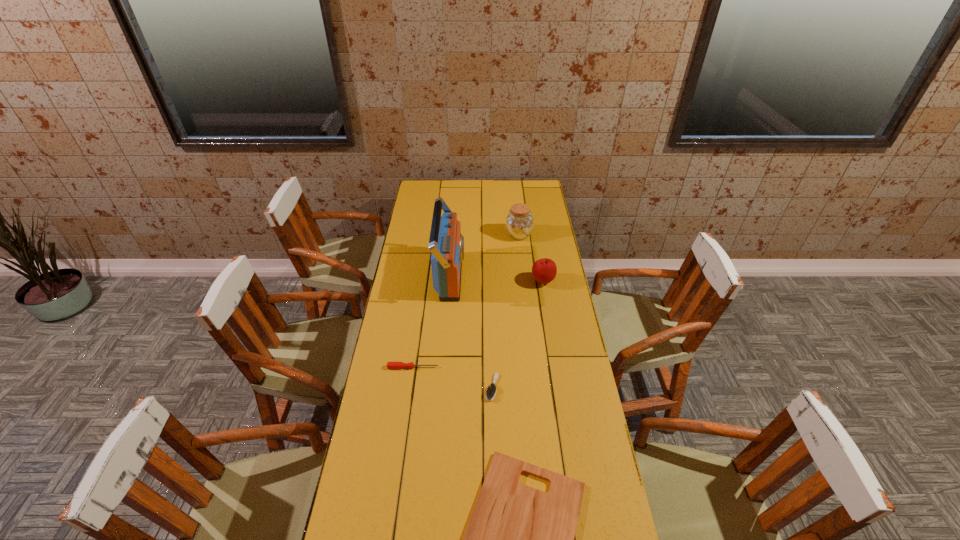
Where is `the tallest object`? The height and width of the screenshot is (540, 960). the tallest object is located at coordinates (446, 243).

Locate an element on the screen. This screenshot has height=540, width=960. the farthest object is located at coordinates (519, 223).

The height and width of the screenshot is (540, 960). Find the location of `jar`. jar is located at coordinates (519, 223).

Find the location of `apple`. apple is located at coordinates (544, 270).

Locate an element on the screen. This screenshot has width=960, height=540. screwdriver is located at coordinates (390, 365).

This screenshot has width=960, height=540. I want to click on the second nearest object, so click(491, 391).

You are a GUI agent. You are given a task and a screenshot of the screen. Output one action in this format:
    pyautogui.click(x=<x>, y=<y>)
    Task: Click on the free location located on the front-facing side of the tallest object
    The height and width of the screenshot is (540, 960).
    Given the screenshot: What is the action you would take?
    pyautogui.click(x=541, y=276)

I want to click on vacant space located 0.050m on the back of the jar, so click(x=517, y=221).

This screenshot has height=540, width=960. In order to click on free space located on the front of the apple in this screenshot , I will do `click(553, 341)`.

I want to click on vacant area situated 0.400m at the tip of the screwdriver, so click(x=549, y=367).